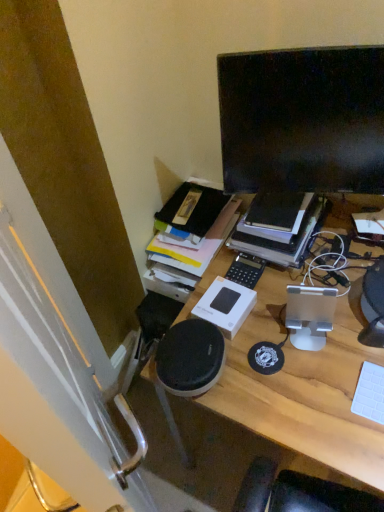
Question: Is white matte keyboard at right to the left or to the right of hardcover book at upper center in the image?

Choices:
 (A) right
 (B) left

Answer: (A)

Question: Is white matte keyboard at right taller or shorter than hardcover book at upper center?

Choices:
 (A) short
 (B) tall

Answer: (A)

Question: Estimate the real-world distances between objects in this image. Which object is closer to the white matte keyboard at right?

Choices:
 (A) wooden desk at center
 (B) hardcover book at upper center
 (C) black glossy monitor at upper right

Answer: (A)

Question: Estimate the real-world distances between objects in this image. Which object is farther from the black glossy monitor at upper right?

Choices:
 (A) hardcover book at upper center
 (B) wooden desk at center
 (C) white matte keyboard at right

Answer: (C)